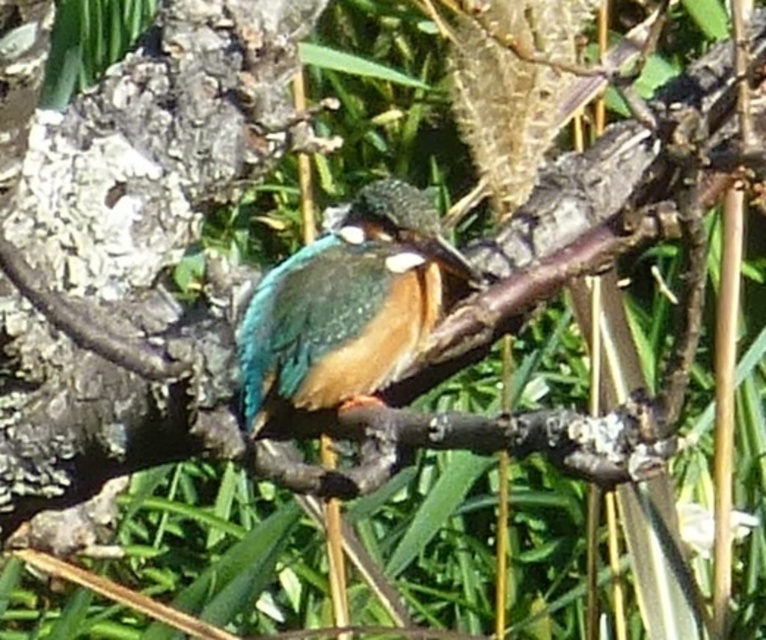
You are standing in the natural setting where the kingfisher is perched. If you look towards the kingfisher, which of the two points, point (21, 477) or point (336, 332), is closer to you?

Point (21, 477) is in front of point (336, 332), so it is closer to you.